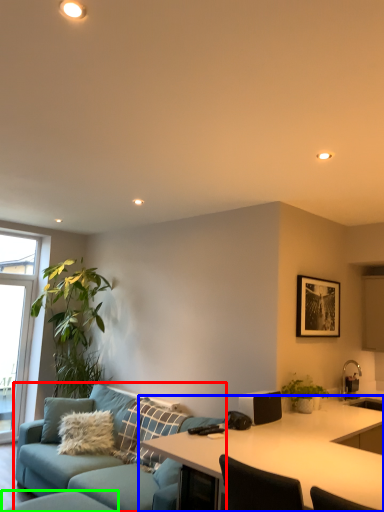
Question: Which is nearer to the studio couch (highlighted by a red box)? desk (highlighted by a blue box) or swivel chair (highlighted by a green box).

Choices:
 (A) desk
 (B) swivel chair

Answer: (B)